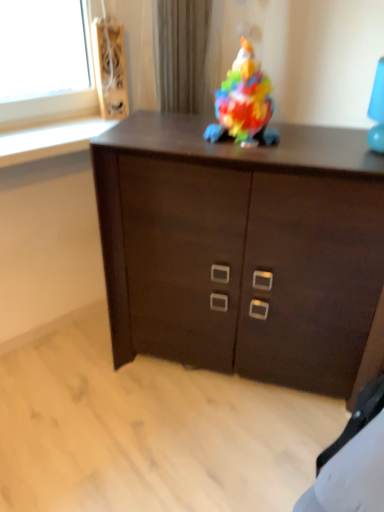
Question: Is multicolored plastic toy at center next to dark wood cabinet at center?

Choices:
 (A) no
 (B) yes

Answer: (A)

Question: Can you confirm if multicolored plastic toy at center is wider than dark wood cabinet at center?

Choices:
 (A) yes
 (B) no

Answer: (B)

Question: Is multicolored plastic toy at center bigger than dark wood cabinet at center?

Choices:
 (A) no
 (B) yes

Answer: (A)

Question: Is multicolored plastic toy at center closer to the viewer compared to dark wood cabinet at center?

Choices:
 (A) yes
 (B) no

Answer: (B)

Question: Can dark wood cabinet at center be found inside multicolored plastic toy at center?

Choices:
 (A) yes
 (B) no

Answer: (B)

Question: Is point (223, 96) closer or farther from the camera than point (102, 101)?

Choices:
 (A) farther
 (B) closer

Answer: (B)

Question: Based on their sizes in the image, would you say multicolored plastic toy at center is bigger or smaller than wooden speaker at upper left?

Choices:
 (A) big
 (B) small

Answer: (A)

Question: From their relative heights in the image, would you say multicolored plastic toy at center is taller or shorter than wooden speaker at upper left?

Choices:
 (A) tall
 (B) short

Answer: (B)

Question: In the image, is multicolored plastic toy at center positioned in front of or behind wooden speaker at upper left?

Choices:
 (A) behind
 (B) front

Answer: (B)

Question: Is dark wood cabinet at center bigger or smaller than wooden speaker at upper left?

Choices:
 (A) small
 (B) big

Answer: (B)

Question: From the image's perspective, is dark wood cabinet at center above or below wooden speaker at upper left?

Choices:
 (A) above
 (B) below

Answer: (B)

Question: In terms of height, does dark wood cabinet at center look taller or shorter compared to wooden speaker at upper left?

Choices:
 (A) short
 (B) tall

Answer: (B)

Question: From a real-world perspective, relative to wooden speaker at upper left, is dark wood cabinet at center vertically above or below?

Choices:
 (A) below
 (B) above

Answer: (A)

Question: Would you say dark wood cabinet at center is to the left or to the right of multicolored plastic toy at center in the picture?

Choices:
 (A) right
 (B) left

Answer: (A)

Question: From the image's perspective, is dark wood cabinet at center located above or below multicolored plastic toy at center?

Choices:
 (A) above
 (B) below

Answer: (B)